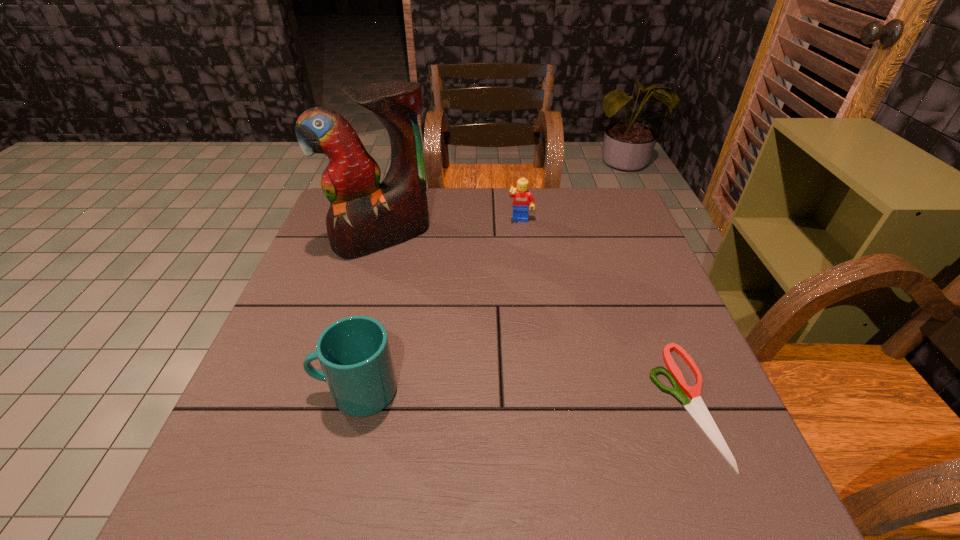
Where is `free space on the desktop that is between the cup and the scissors and is positioned on the face of the Lego`? Image resolution: width=960 pixels, height=540 pixels. free space on the desktop that is between the cup and the scissors and is positioned on the face of the Lego is located at coordinates (504, 396).

Find the location of `vacant spot on the desktop that is between the cup and the rightmost object and is positioned at the face of the tallest object`. vacant spot on the desktop that is between the cup and the rightmost object and is positioned at the face of the tallest object is located at coordinates (493, 396).